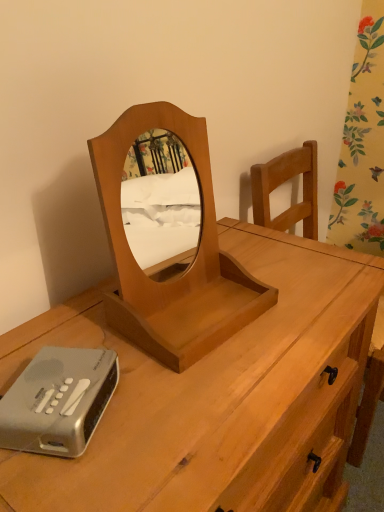
Identify the location of vacant area that lies to the right of light brown wood mirror at center. The image size is (384, 512). (298, 313).